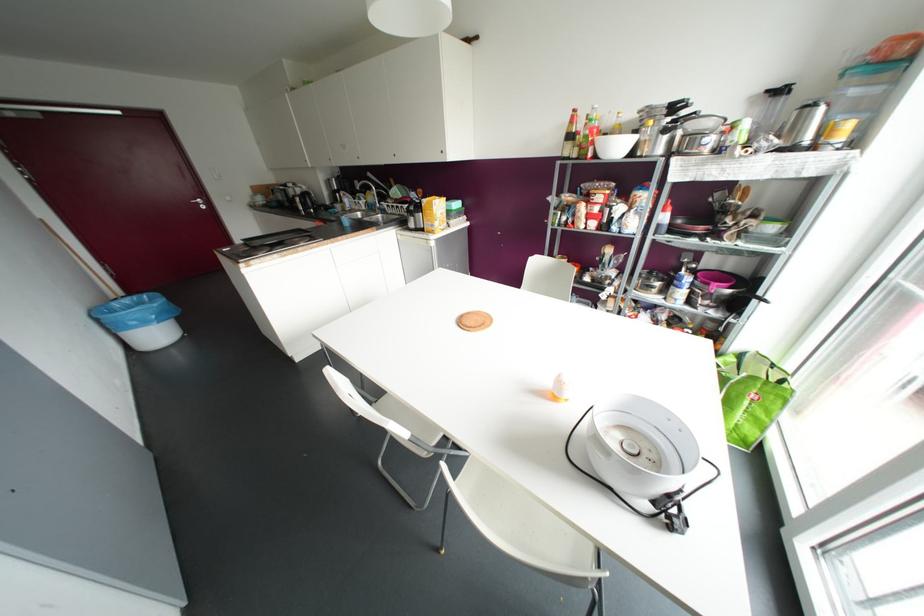
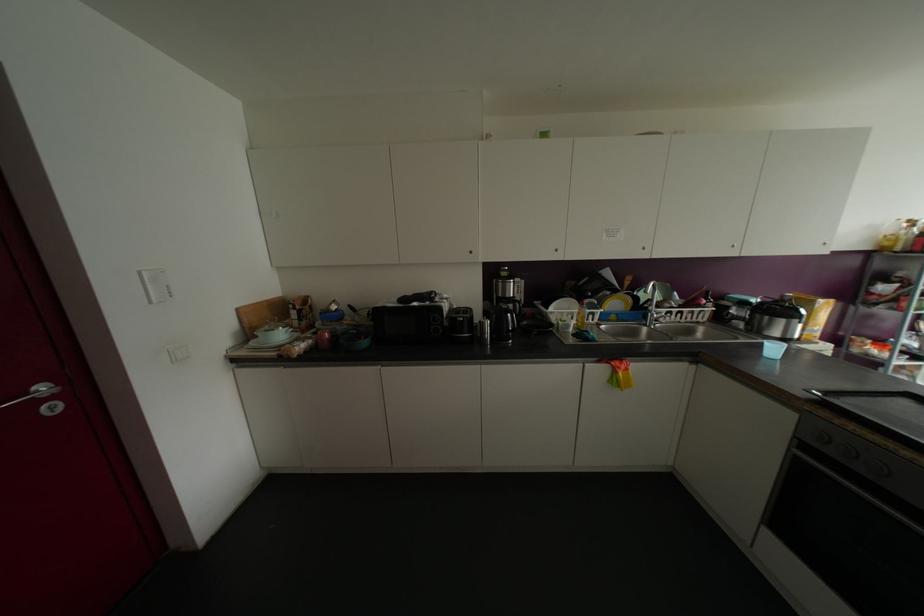
Where in the second image is the point corresponding to the point at 274,204 from the first image?

(363, 342)